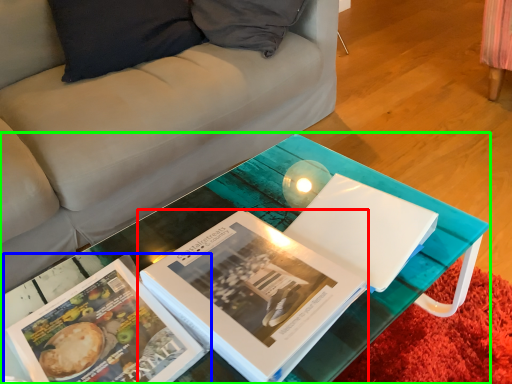
Question: Considering the real-world distances, which object is farthest from book (highlighted by a red box)? book (highlighted by a blue box) or table (highlighted by a green box)?

Choices:
 (A) book
 (B) table

Answer: (A)